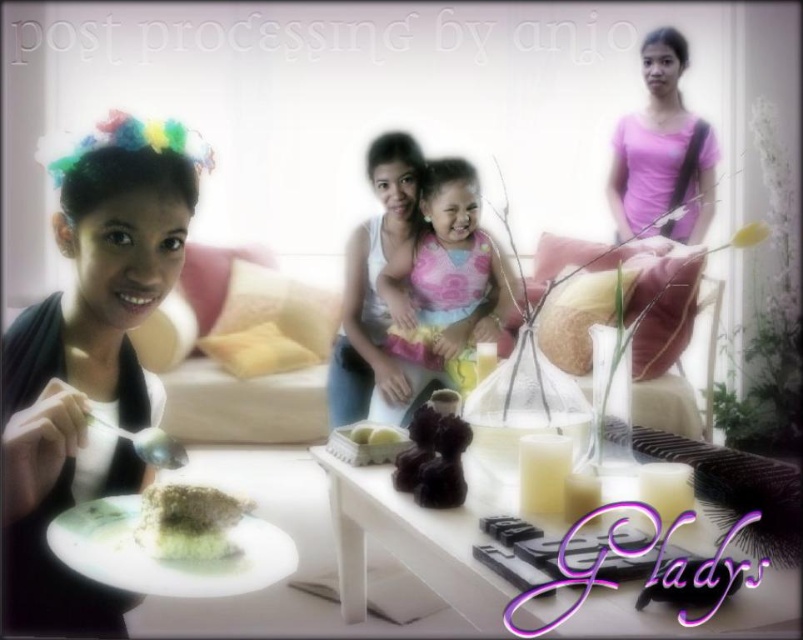
Does white glossy table at center appear on the right side of pink cotton shirt at upper right?

No, white glossy table at center is not to the right of pink cotton shirt at upper right.

Can you confirm if white glossy table at center is smaller than pink cotton shirt at upper right?

Incorrect, white glossy table at center is not smaller in size than pink cotton shirt at upper right.

Is point (327, 454) positioned behind point (665, 129)?

No, (327, 454) is in front of (665, 129).

Identify the location of white glossy table at center. This screenshot has height=640, width=803. (418, 534).

Which of these two, pink cotton shirt at upper right or green crumbly cake at lower left, stands shorter?

With less height is green crumbly cake at lower left.

Who is positioned more to the right, pink cotton shirt at upper right or green crumbly cake at lower left?

pink cotton shirt at upper right is more to the right.

Who is more distant from viewer, (698, 224) or (149, 515)?

The point (698, 224) is behind.

Find the location of a particular element. pink cotton shirt at upper right is located at coordinates (661, 150).

Between point (651, 124) and point (212, 592), which one is positioned behind?

The point (651, 124) is more distant.

Who is taller, pink cotton shirt at upper right or green matte plate at lower left?

Standing taller between the two is pink cotton shirt at upper right.

Where is `pink cotton shirt at upper right`? The width and height of the screenshot is (803, 640). pink cotton shirt at upper right is located at coordinates (661, 150).